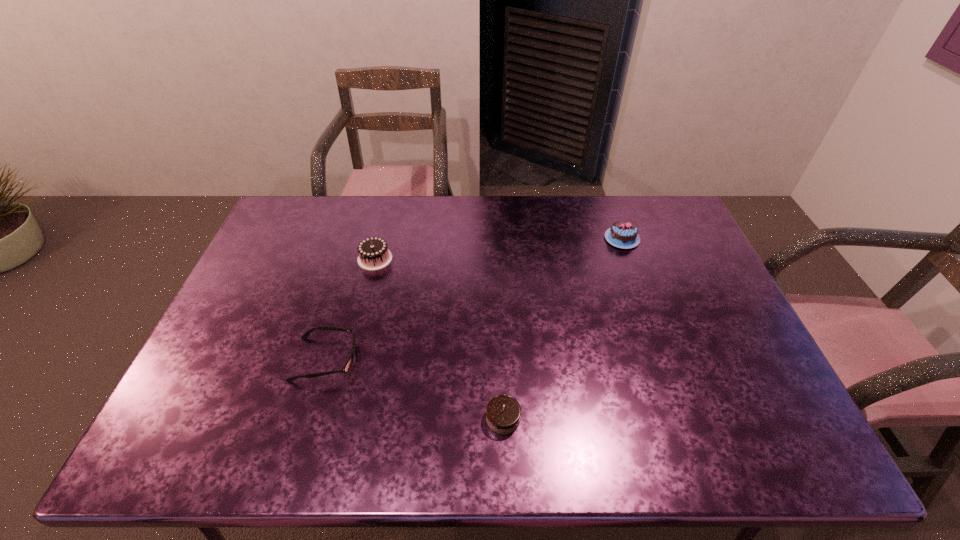
The height and width of the screenshot is (540, 960). In order to click on the leftmost chocolate cake in this screenshot , I will do `click(373, 252)`.

You are a GUI agent. You are given a task and a screenshot of the screen. Output one action in this format:
    pyautogui.click(x=<x>, y=<y>)
    Task: Click on the tallest chocolate cake
    This screenshot has width=960, height=540.
    Given the screenshot: What is the action you would take?
    pyautogui.click(x=373, y=252)

The width and height of the screenshot is (960, 540). I want to click on the rightmost object, so click(x=622, y=234).

Where is `the nearest chocolate cake`? the nearest chocolate cake is located at coordinates (503, 412).

Image resolution: width=960 pixels, height=540 pixels. I want to click on the second chocolate cake from left to right, so click(x=503, y=412).

The height and width of the screenshot is (540, 960). Find the location of `the second nearest object`. the second nearest object is located at coordinates (348, 364).

You are a GUI agent. You are given a task and a screenshot of the screen. Output one action in this format:
    pyautogui.click(x=<x>, y=<y>)
    Task: Click on the spectacles
    
    Given the screenshot: What is the action you would take?
    [x=348, y=364]

Where is `vacant space located 0.050m on the back of the tallest object`? This screenshot has width=960, height=540. vacant space located 0.050m on the back of the tallest object is located at coordinates (380, 238).

Where is `free space located 0.180m on the right of the rightmost object`? The height and width of the screenshot is (540, 960). free space located 0.180m on the right of the rightmost object is located at coordinates (692, 239).

Locate an element on the screen. This screenshot has height=540, width=960. free space located 0.200m on the left of the second object from right to left is located at coordinates (401, 418).